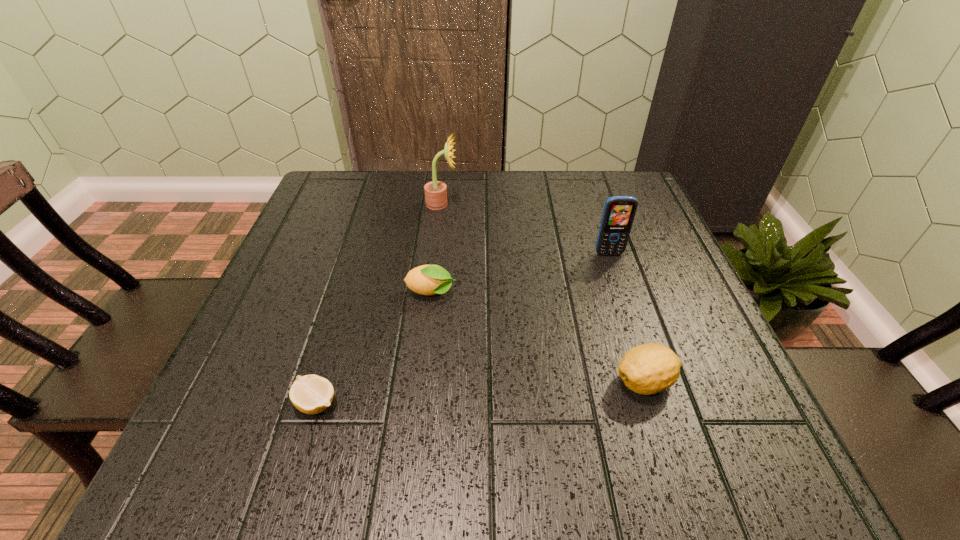
In order to click on free point at the far edge in this screenshot , I will do `click(526, 220)`.

Image resolution: width=960 pixels, height=540 pixels. Identify the location of free space at the near edge of the desktop. (404, 447).

The width and height of the screenshot is (960, 540). I want to click on free region at the left edge of the desktop, so click(x=314, y=286).

Locate an element on the screen. The width and height of the screenshot is (960, 540). vacant space at the right edge of the desktop is located at coordinates (626, 278).

In the image, there is a desktop. At what (x,y) coordinates should I click in order to perform the action: click on free space at the near left corner. Please return your answer as a coordinate pair (x, y). Looking at the image, I should click on (260, 463).

In the image, there is a desktop. Identify the location of blank space at the near right corner. The height and width of the screenshot is (540, 960). (775, 469).

Where is `empty space between the second farthest object and the sunflower`? empty space between the second farthest object and the sunflower is located at coordinates (525, 229).

Where is `free area in between the second tallest object and the shortest lemon`? The height and width of the screenshot is (540, 960). free area in between the second tallest object and the shortest lemon is located at coordinates (463, 328).

The image size is (960, 540). I want to click on free space between the leftmost lemon and the rightmost lemon, so click(481, 393).

Identify the location of empty location between the farthest object and the rightmost lemon. The image size is (960, 540). (543, 293).